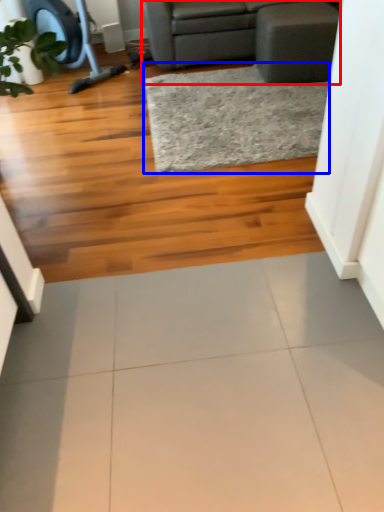
Question: Which object is further to the camera taking this photo, studio couch (highlighted by a red box) or mat (highlighted by a blue box)?

Choices:
 (A) studio couch
 (B) mat

Answer: (A)